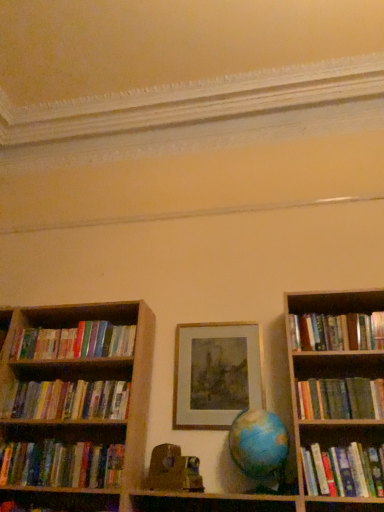
I want to click on hardcover books at left, which is counted as the 2th book, starting from the top, so click(75, 341).

Where is `hardcover books at left, which is the second book from bottom to top`? hardcover books at left, which is the second book from bottom to top is located at coordinates (62, 465).

What do you see at coordinates (62, 465) in the screenshot? This screenshot has width=384, height=512. I see `hardcover books at left, the sixth book in the top-to-bottom sequence` at bounding box center [62, 465].

What do you see at coordinates (215, 374) in the screenshot? The height and width of the screenshot is (512, 384). I see `gold metallic picture frame at center` at bounding box center [215, 374].

The height and width of the screenshot is (512, 384). Find the location of `wooden toy at center`. wooden toy at center is located at coordinates (173, 470).

I want to click on hardcover book at lower left, the first book when ordered from bottom to top, so click(x=62, y=501).

This screenshot has height=512, width=384. Identify the location of hardcover books at left, which is counted as the 2th book, starting from the top. [75, 341].

How many degrees apart are the facing directions of hardcover books at left, which is the fourth book in top-to-bottom order, and hardcover books at left, the sixth book in the top-to-bottom sequence?

hardcover books at left, which is the fourth book in top-to-bottom order, and hardcover books at left, the sixth book in the top-to-bottom sequence, are facing 0.000145 degrees away from each other.

In terms of width, does hardcover books at left, which ranks as the 4th book in bottom-to-top order, look wider or thinner when compared to hardcover books at left, the sixth book in the top-to-bottom sequence?

hardcover books at left, which ranks as the 4th book in bottom-to-top order, is thinner than hardcover books at left, the sixth book in the top-to-bottom sequence.

Is hardcover books at left, which ranks as the 4th book in bottom-to-top order, not within hardcover books at left, the sixth book in the top-to-bottom sequence?

Yes, hardcover books at left, which ranks as the 4th book in bottom-to-top order, is not within hardcover books at left, the sixth book in the top-to-bottom sequence.

Considering the relative sizes of hardcover books at left, which is the fourth book in top-to-bottom order, and hardcover books at left, which is the second book from bottom to top, in the image provided, is hardcover books at left, which is the fourth book in top-to-bottom order, taller than hardcover books at left, which is the second book from bottom to top,?

In fact, hardcover books at left, which is the fourth book in top-to-bottom order, may be shorter than hardcover books at left, which is the second book from bottom to top.

Which object is thinner, green matte bookshelf at right, the 5th book in the bottom-to-top sequence, or gold metallic picture frame at center?

With smaller width is gold metallic picture frame at center.

Between green matte bookshelf at right, which ranks as the third book in top-to-bottom order, and gold metallic picture frame at center, which one has larger size?

green matte bookshelf at right, which ranks as the third book in top-to-bottom order.

Is point (327, 385) less distant than point (256, 350)?

That is True.

From a real-world perspective, which is physically above, green matte bookshelf at right, which ranks as the third book in top-to-bottom order, or gold metallic picture frame at center?

In real-world perspective, gold metallic picture frame at center is above.

Looking at the image, does hardcover book at lower left, the first book when ordered from bottom to top, seem bigger or smaller compared to green matte bookshelf at right, the 5th book in the bottom-to-top sequence?

hardcover book at lower left, the first book when ordered from bottom to top, is smaller than green matte bookshelf at right, the 5th book in the bottom-to-top sequence.

Does hardcover book at lower left, which is counted as the seventh book, starting from the top, have a greater width compared to green matte bookshelf at right, which ranks as the third book in top-to-bottom order?

No.

In the scene shown: Considering the relative positions of hardcover book at lower left, the first book when ordered from bottom to top, and green matte bookshelf at right, which ranks as the third book in top-to-bottom order, in the image provided, is hardcover book at lower left, the first book when ordered from bottom to top, to the right of green matte bookshelf at right, which ranks as the third book in top-to-bottom order, from the viewer's perspective?

No.

Are hardcover book at lower left, which is counted as the seventh book, starting from the top, and green matte bookshelf at right, which ranks as the third book in top-to-bottom order, far apart?

Yes, hardcover book at lower left, which is counted as the seventh book, starting from the top, is far from green matte bookshelf at right, which ranks as the third book in top-to-bottom order.

From a real-world perspective, is wooden toy at center over gold metallic picture frame at center?

No, from a real-world perspective, wooden toy at center is not over gold metallic picture frame at center

Is point (165, 449) positioned behind point (213, 396)?

No, (165, 449) is in front of (213, 396).

Consider the image. Is wooden toy at center turned away from gold metallic picture frame at center?

No, gold metallic picture frame at center is not at the back of wooden toy at center.

Looking at the image, does wooden toy at center seem bigger or smaller compared to gold metallic picture frame at center?

In the image, wooden toy at center appears to be smaller than gold metallic picture frame at center.

Image resolution: width=384 pixels, height=512 pixels. There is a hardcover books at left, which is the fourth book in top-to-bottom order. Identify the location of the 3rd book above it (from the image's perspective). (337, 332).

From a real-world perspective, relative to hardcover books at right, the first book in the top-to-bottom sequence, is hardcover books at left, which ranks as the 4th book in bottom-to-top order, vertically above or below?

hardcover books at left, which ranks as the 4th book in bottom-to-top order, is below hardcover books at right, the first book in the top-to-bottom sequence.

Measure the distance from hardcover books at left, which is the fourth book in top-to-bottom order, to hardcover books at right, the first book in the top-to-bottom sequence.

A distance of 3.89 feet exists between hardcover books at left, which is the fourth book in top-to-bottom order, and hardcover books at right, the first book in the top-to-bottom sequence.

Is hardcover books at left, which ranks as the 4th book in bottom-to-top order, far away from hardcover books at right, the first book in the top-to-bottom sequence?

Yes, hardcover books at left, which ranks as the 4th book in bottom-to-top order, and hardcover books at right, the first book in the top-to-bottom sequence, are quite far apart.

Which of these two, wooden toy at center or green matte bookshelf at right, which ranks as the third book in top-to-bottom order, stands taller?

green matte bookshelf at right, which ranks as the third book in top-to-bottom order, is taller.

From a real-world perspective, is wooden toy at center beneath green matte bookshelf at right, the 5th book in the bottom-to-top sequence?

Correct, in the physical world, wooden toy at center is lower than green matte bookshelf at right, the 5th book in the bottom-to-top sequence.

Find the location of a particular element. The width and height of the screenshot is (384, 512). toy below the green matte bookshelf at right, the 5th book in the bottom-to-top sequence (from the image's perspective) is located at coordinates (173, 470).

From the picture: Between hardcover books at left, which ranks as the 4th book in bottom-to-top order, and gold metallic picture frame at center, which one appears on the left side from the viewer's perspective?

From the viewer's perspective, hardcover books at left, which ranks as the 4th book in bottom-to-top order, appears more on the left side.

Considering the relative sizes of hardcover books at left, which ranks as the 4th book in bottom-to-top order, and gold metallic picture frame at center in the image provided, is hardcover books at left, which ranks as the 4th book in bottom-to-top order, shorter than gold metallic picture frame at center?

Yes, hardcover books at left, which ranks as the 4th book in bottom-to-top order, is shorter than gold metallic picture frame at center.

From a real-world perspective, between hardcover books at left, which is the fourth book in top-to-bottom order, and gold metallic picture frame at center, who is vertically higher?

gold metallic picture frame at center, from a real-world perspective.

From the hardcover books at left, the sixth book in the top-to-bottom sequence, count 2nd book to the right and point to it. Please provide its 2D coordinates.

[(66, 400)]

This screenshot has width=384, height=512. In order to click on the 5th book in front of the gold metallic picture frame at center in this screenshot , I will do `click(341, 398)`.

Which object lies further to the anchor point hardcover books at right, which ranks as the 3th book in bottom-to-top order, hardcover books at left, the sixth book in the top-to-bottom sequence, or hardcover books at right, the first book in the top-to-bottom sequence?

hardcover books at left, the sixth book in the top-to-bottom sequence.

Which object lies further to the anchor point hardcover books at left, which is the 6th book in bottom-to-top order, hardcover books at left, which is the second book from bottom to top, or hardcover books at right, which is counted as the seventh book, starting from the bottom?

Among the two, hardcover books at right, which is counted as the seventh book, starting from the bottom, is located further to hardcover books at left, which is the 6th book in bottom-to-top order.

Estimate the real-world distances between objects in this image. Which object is closer to gold metallic picture frame at center, green matte bookshelf at right, which ranks as the third book in top-to-bottom order, or hardcover books at left, which is the 6th book in bottom-to-top order?

Based on the image, green matte bookshelf at right, which ranks as the third book in top-to-bottom order, appears to be nearer to gold metallic picture frame at center.

Considering their positions, is gold metallic picture frame at center positioned further to green matte bookshelf at right, which ranks as the third book in top-to-bottom order, than hardcover books at left, which is counted as the 2th book, starting from the top?

Among the two, hardcover books at left, which is counted as the 2th book, starting from the top, is located further to green matte bookshelf at right, which ranks as the third book in top-to-bottom order.

Considering their positions, is hardcover book at lower left, the first book when ordered from bottom to top, positioned further to hardcover books at left, which is the fourth book in top-to-bottom order, than wooden toy at center?

wooden toy at center is positioned further to the anchor hardcover books at left, which is the fourth book in top-to-bottom order.

Looking at the image, which one is located closer to hardcover books at right, which is counted as the seventh book, starting from the bottom, gold metallic picture frame at center or hardcover book at lower left, the first book when ordered from bottom to top?

gold metallic picture frame at center is positioned closer to the anchor hardcover books at right, which is counted as the seventh book, starting from the bottom.

From the image, which object appears to be nearer to gold metallic picture frame at center, hardcover books at left, which is the fourth book in top-to-bottom order, or hardcover book at lower left, which is counted as the seventh book, starting from the top?

Based on the image, hardcover books at left, which is the fourth book in top-to-bottom order, appears to be nearer to gold metallic picture frame at center.

From the image, which object appears to be farther from hardcover book at lower left, the first book when ordered from bottom to top, green matte bookshelf at right, which ranks as the third book in top-to-bottom order, or wooden toy at center?

The object further to hardcover book at lower left, the first book when ordered from bottom to top, is green matte bookshelf at right, which ranks as the third book in top-to-bottom order.

Where is `picture frame situated between hardcover books at left, which is counted as the 2th book, starting from the top, and hardcover books at right, the first book in the top-to-bottom sequence, from left to right`? The image size is (384, 512). picture frame situated between hardcover books at left, which is counted as the 2th book, starting from the top, and hardcover books at right, the first book in the top-to-bottom sequence, from left to right is located at coordinates (215, 374).

At what (x,y) coordinates should I click in order to perform the action: click on toy between hardcover books at left, which is the second book from bottom to top, and gold metallic picture frame at center from left to right. Please return your answer as a coordinate pair (x, y). Looking at the image, I should click on (173, 470).

Identify the location of picture frame situated between hardcover books at left, which is counted as the 2th book, starting from the top, and green matte bookshelf at right, the 5th book in the bottom-to-top sequence, from left to right. (215, 374).

Locate an element on the screen. This screenshot has width=384, height=512. picture frame between hardcover books at left, the sixth book in the top-to-bottom sequence, and hardcover books at right, which ranks as the 3th book in bottom-to-top order is located at coordinates (215, 374).